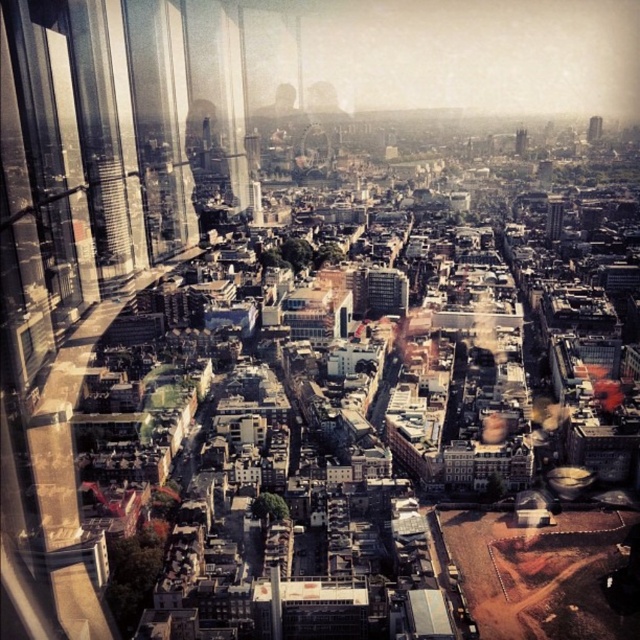
Does smooth glass tower at center have a smaller size compared to smooth glass tower at upper right?

Actually, smooth glass tower at center might be larger than smooth glass tower at upper right.

Is point (557, 200) in front of point (593, 118)?

Yes, point (557, 200) is in front of point (593, 118).

Is point (556, 237) closer to viewer compared to point (593, 115)?

Yes.

Locate an element on the screen. The image size is (640, 640). smooth glass tower at center is located at coordinates (554, 218).

Is smooth glass tower at center bigger than dark brown stone tower at center?

Yes, smooth glass tower at center is bigger than dark brown stone tower at center.

Who is higher up, smooth glass tower at center or dark brown stone tower at center?

dark brown stone tower at center

Is point (557, 204) positioned behind point (525, 132)?

No, (557, 204) is closer to viewer.

You are a GUI agent. You are given a task and a screenshot of the screen. Output one action in this format:
    pyautogui.click(x=<x>, y=<y>)
    Task: Click on the smooth glass tower at center
    This screenshot has height=640, width=640.
    Given the screenshot: What is the action you would take?
    pyautogui.click(x=554, y=218)

Is smooth glass tower at upper right thinner than dark brown stone tower at center?

In fact, smooth glass tower at upper right might be wider than dark brown stone tower at center.

Is smooth glass tower at upper right taller than dark brown stone tower at center?

Correct, smooth glass tower at upper right is much taller as dark brown stone tower at center.

You are a GUI agent. You are given a task and a screenshot of the screen. Output one action in this format:
    pyautogui.click(x=<x>, y=<y>)
    Task: Click on the smooth glass tower at upper right
    The width and height of the screenshot is (640, 640).
    Given the screenshot: What is the action you would take?
    [x=595, y=129]